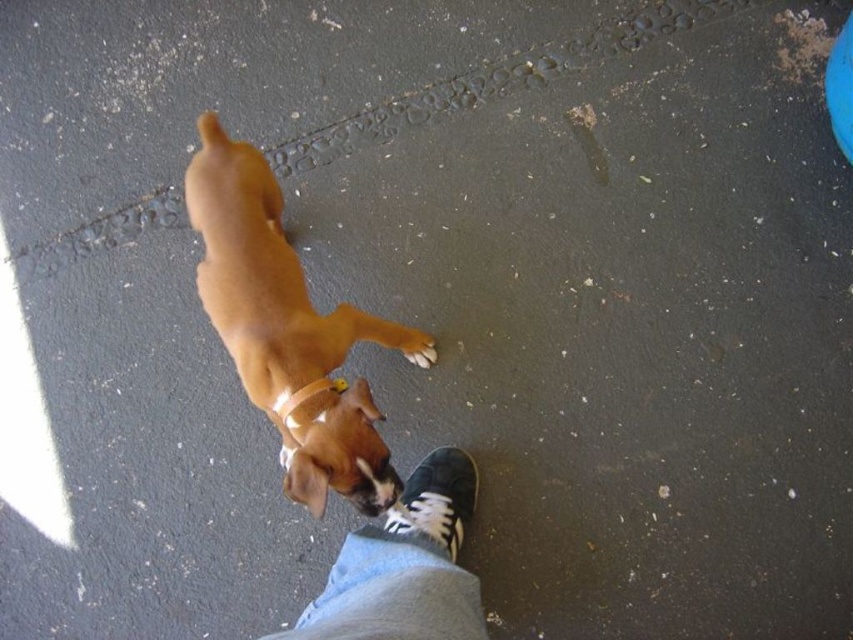
You are a photographer taking a picture from above. You see a brown leather dog at center and a white leather shoe at center. Which object is closer to the camera?

The brown leather dog at center is closer to the camera because it is positioned above the white leather shoe at center.

You are a delivery robot that needs to pass between the white leather shoe at center and the white rubber neckband at center. The robot is 0.3 meters wide. Can it fit through the space between them?

The white leather shoe at center is wider than the white rubber neckband at center, but the description does not provide the exact distance between them. Without knowing the actual space between the two objects, it is impossible to determine if the robot can fit through.